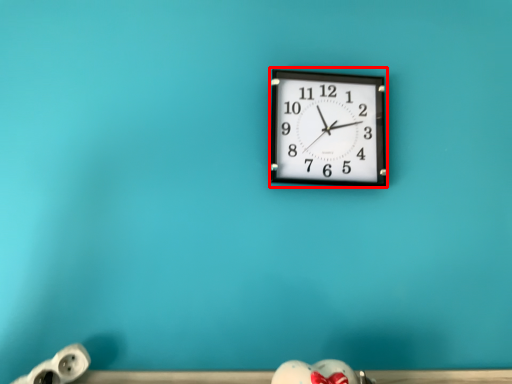
Question: Considering the relative positions of wall clock (annotated by the red box) and toy in the image provided, where is wall clock (annotated by the red box) located with respect to the staircase?

Choices:
 (A) left
 (B) right

Answer: (B)